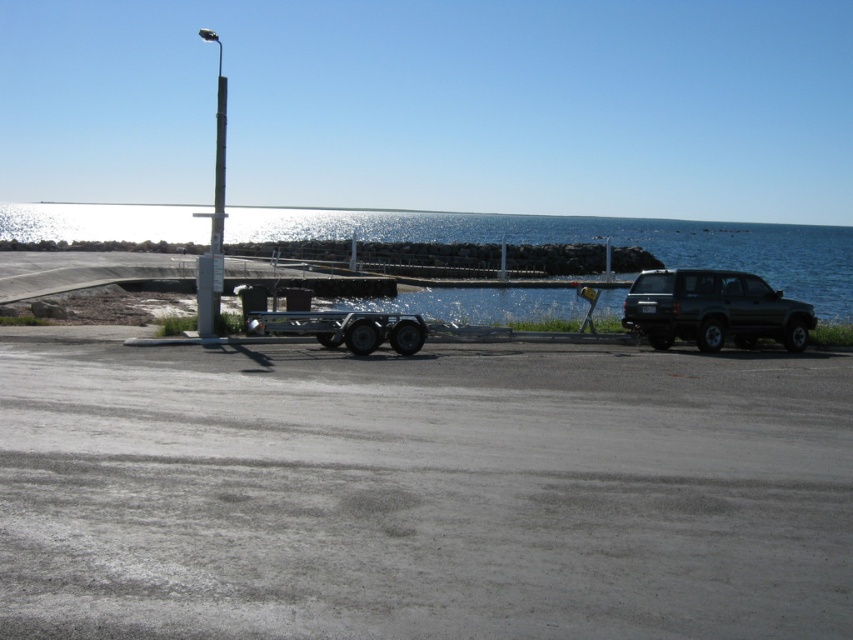
Question: Which object is the closest to the gray asphalt parking lot at center?

Choices:
 (A) glistening water at center
 (B) black matte suv at right
 (C) metallic pole at left
 (D) shiny metallic dune buggy at center

Answer: (D)

Question: Is glistening water at center further to camera compared to shiny metallic dune buggy at center?

Choices:
 (A) yes
 (B) no

Answer: (A)

Question: Is gray asphalt parking lot at center behind glistening water at center?

Choices:
 (A) yes
 (B) no

Answer: (B)

Question: Which is nearer to the glistening water at center?

Choices:
 (A) shiny metallic dune buggy at center
 (B) gray asphalt parking lot at center
 (C) black matte suv at right
 (D) metallic pole at left

Answer: (D)

Question: Is black matte suv at right bigger than shiny metallic dune buggy at center?

Choices:
 (A) no
 (B) yes

Answer: (B)

Question: Which point is farther to the camera?

Choices:
 (A) (334, 324)
 (B) (473, 241)

Answer: (B)